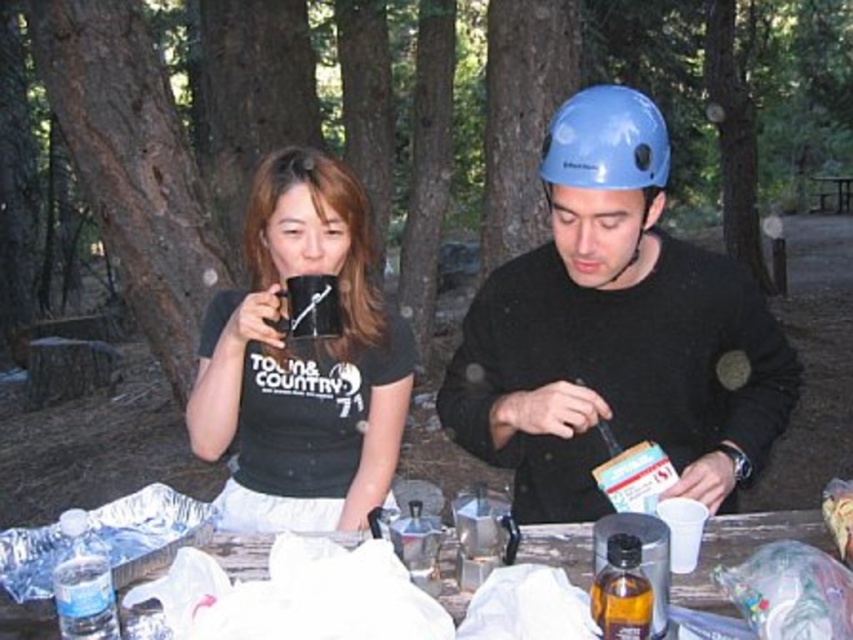
Which is more to the right, white plastic bag at lower center or translucent amber liquid at center?

white plastic bag at lower center is more to the right.

Is white plastic bag at lower center behind translucent amber liquid at center?

Yes, it is behind translucent amber liquid at center.

Between point (708, 596) and point (622, 589), which one is positioned in front?

Point (622, 589) is in front.

The image size is (853, 640). Find the location of `white plastic bag at lower center`. white plastic bag at lower center is located at coordinates (741, 550).

Which of these two, matte black mug at center or wooden picnic table at center, stands shorter?

wooden picnic table at center

Measure the distance between matte black mug at center and camera.

A: matte black mug at center is 4.84 feet from camera.

Is point (349, 396) behind point (834, 179)?

No, it is not.

Locate an element on the screen. The height and width of the screenshot is (640, 853). matte black mug at center is located at coordinates (302, 362).

Based on the photo, can you confirm if translucent amber liquid at center is positioned above clear plastic water bottle at lower left?

Indeed, translucent amber liquid at center is positioned over clear plastic water bottle at lower left.

Who is lower down, translucent amber liquid at center or clear plastic water bottle at lower left?

clear plastic water bottle at lower left is below.

You are a GUI agent. You are given a task and a screenshot of the screen. Output one action in this format:
    pyautogui.click(x=<x>, y=<y>)
    Task: Click on the translucent amber liquid at center
    This screenshot has width=853, height=640.
    Given the screenshot: What is the action you would take?
    pyautogui.click(x=622, y=592)

At what (x,y) coordinates should I click in order to perform the action: click on translucent amber liquid at center. Please return your answer as a coordinate pair (x, y). The height and width of the screenshot is (640, 853). Looking at the image, I should click on (622, 592).